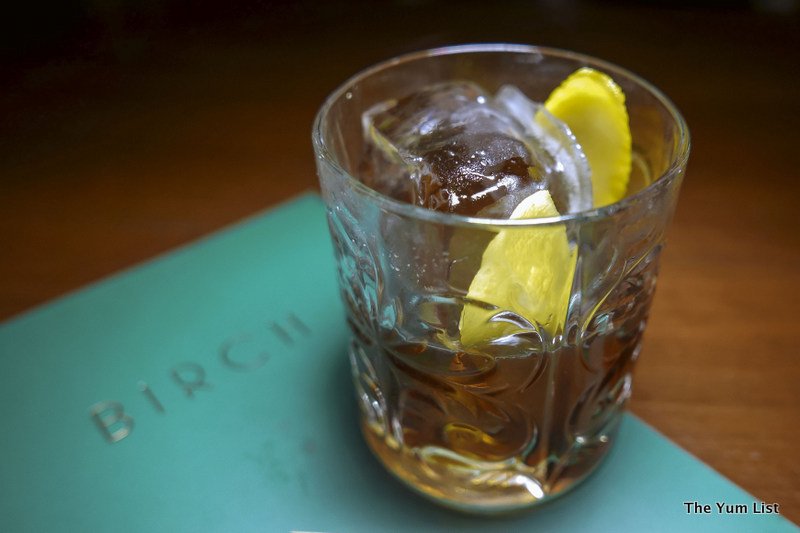
Identify the location of rim of glass. (x=616, y=214).